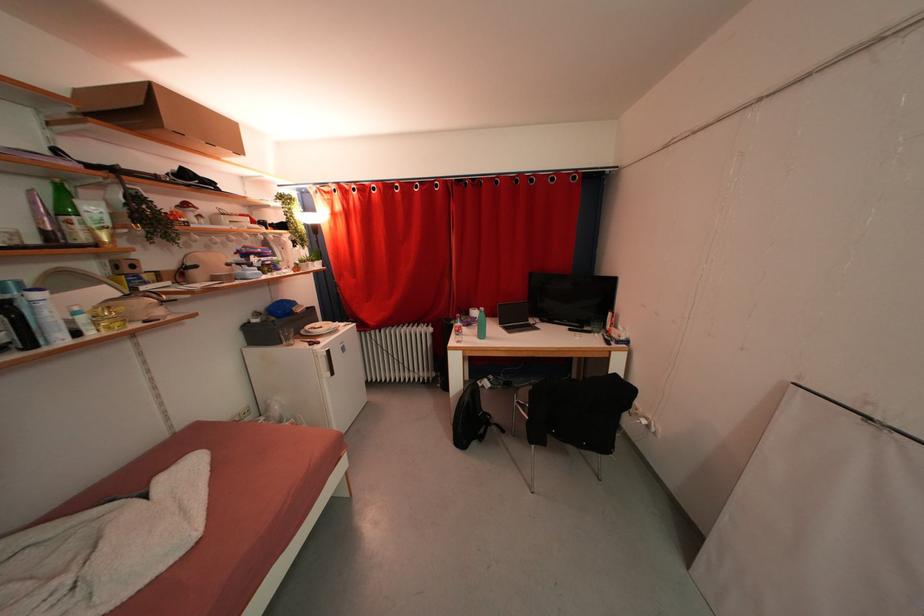
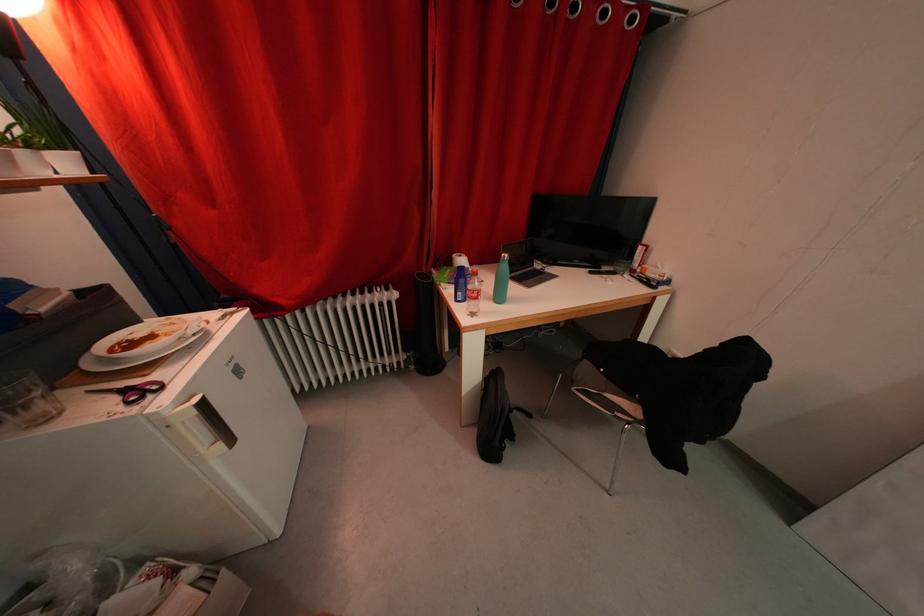
Find the pixel in the second image that matches (x=406, y=331) in the first image.

(346, 302)